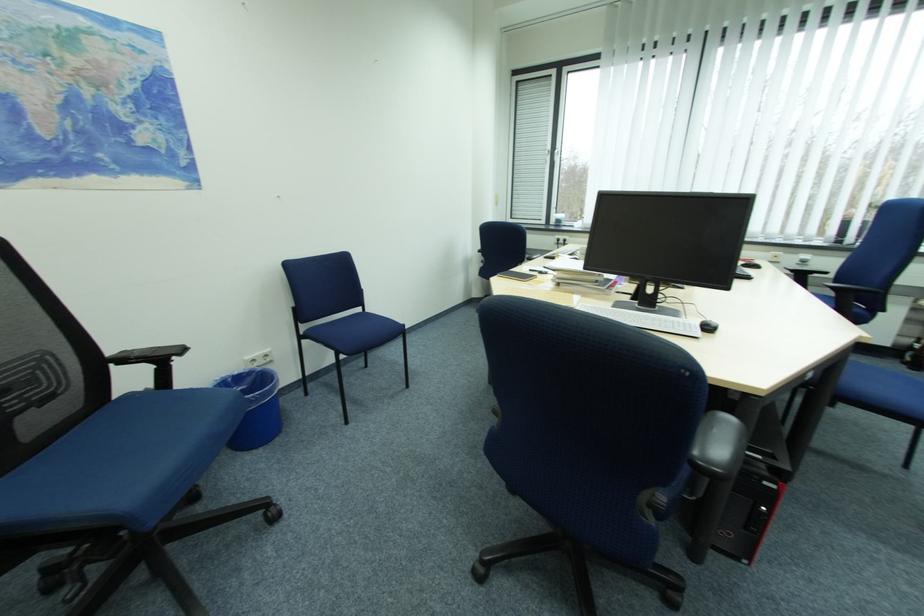
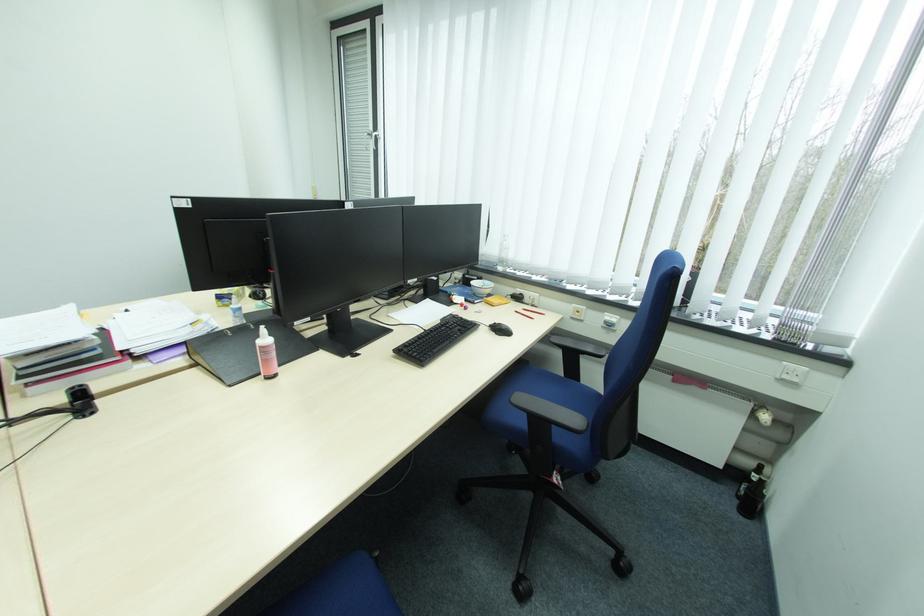
What movement of the cameraman would produce the second image?

The cameraman moved toward right, forward.